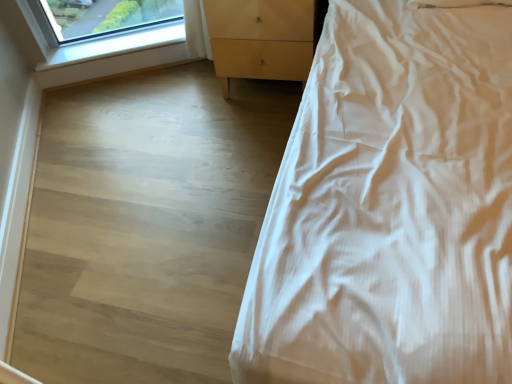
Question: Does point (272, 18) appear closer or farther from the camera than point (172, 59)?

Choices:
 (A) closer
 (B) farther

Answer: (A)

Question: In the image, is light wood/texture chest of drawers at center positioned in front of or behind light wood at upper left?

Choices:
 (A) behind
 (B) front

Answer: (B)

Question: Which is nearer to the white smooth bed at right?

Choices:
 (A) light wood/texture chest of drawers at center
 (B) light wood at upper left
 (C) clear glass window at upper left

Answer: (A)

Question: Based on their relative distances, which object is nearer to the light wood at upper left?

Choices:
 (A) clear glass window at upper left
 (B) white smooth bed at right
 (C) light wood/texture chest of drawers at center

Answer: (A)